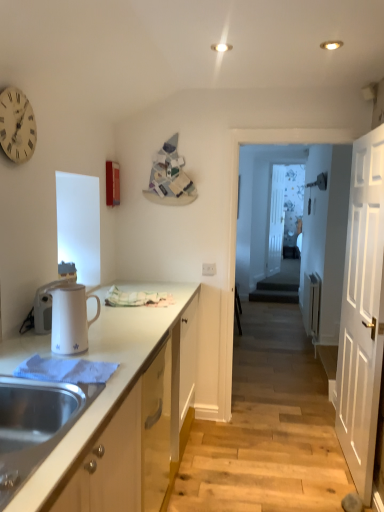
Where is `empty space that is to the right of white glossy electric kettle at left, the second appliance in the front-to-back sequence`? Image resolution: width=384 pixels, height=512 pixels. empty space that is to the right of white glossy electric kettle at left, the second appliance in the front-to-back sequence is located at coordinates (104, 328).